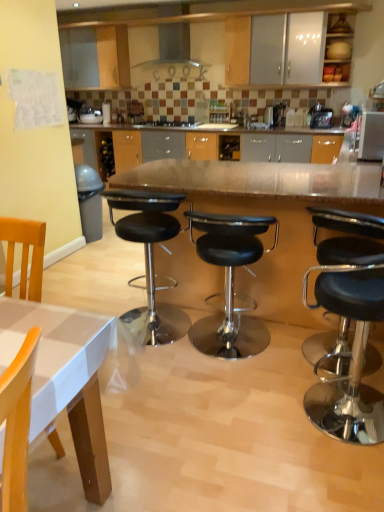
Question: Should I look upward or downward to see black leather stool at center, which is counted as the first stool, starting from the left?

Choices:
 (A) down
 (B) up

Answer: (A)

Question: Is wooden chair at lower left directly adjacent to black glass stove at center?

Choices:
 (A) yes
 (B) no

Answer: (B)

Question: Does wooden chair at lower left appear on the right side of black glass stove at center?

Choices:
 (A) yes
 (B) no

Answer: (B)

Question: Is wooden chair at lower left far from black glass stove at center?

Choices:
 (A) no
 (B) yes

Answer: (B)

Question: Is the position of wooden chair at lower left more distant than that of black glass stove at center?

Choices:
 (A) yes
 (B) no

Answer: (B)

Question: Is wooden chair at lower left oriented towards black glass stove at center?

Choices:
 (A) yes
 (B) no

Answer: (B)

Question: Is wooden chair at lower left not within black glass stove at center?

Choices:
 (A) yes
 (B) no

Answer: (A)

Question: Can you confirm if polished wood table at center is positioned to the right of black glass stove at center?

Choices:
 (A) no
 (B) yes

Answer: (B)

Question: Is black glass stove at center inside polished wood table at center?

Choices:
 (A) yes
 (B) no

Answer: (B)

Question: Is polished wood table at center facing towards black glass stove at center?

Choices:
 (A) yes
 (B) no

Answer: (A)

Question: From the image's perspective, is polished wood table at center located above black glass stove at center?

Choices:
 (A) no
 (B) yes

Answer: (A)

Question: Can you confirm if polished wood table at center is shorter than black glass stove at center?

Choices:
 (A) yes
 (B) no

Answer: (B)

Question: Does polished wood table at center have a lesser width compared to black glass stove at center?

Choices:
 (A) yes
 (B) no

Answer: (B)

Question: Is black leather stool at right, which is counted as the 1th stool, starting from the right, in front of matte wood cabinet at upper right?

Choices:
 (A) yes
 (B) no

Answer: (A)